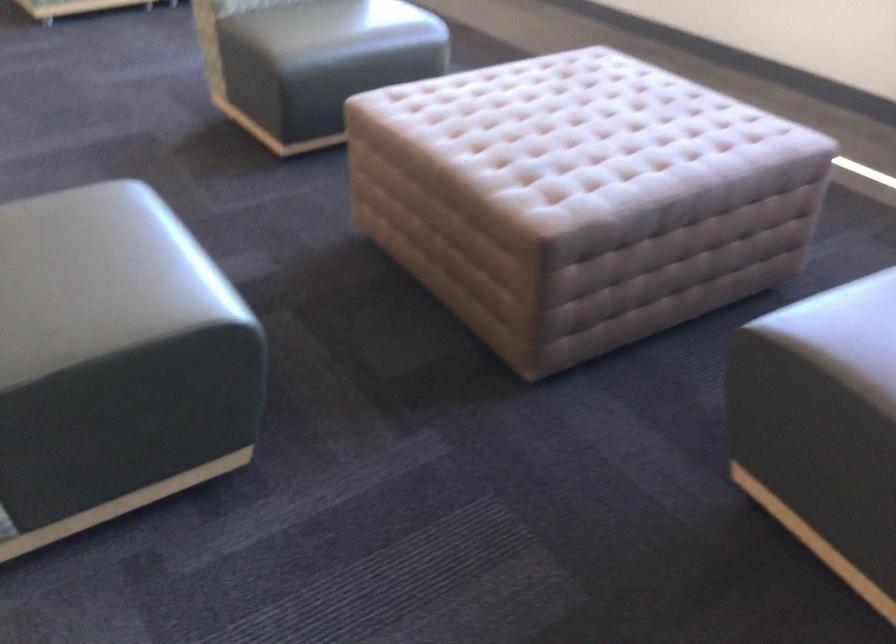
Image resolution: width=896 pixels, height=644 pixels. Describe the element at coordinates (586, 147) in the screenshot. I see `the tufted chair sitting surface` at that location.